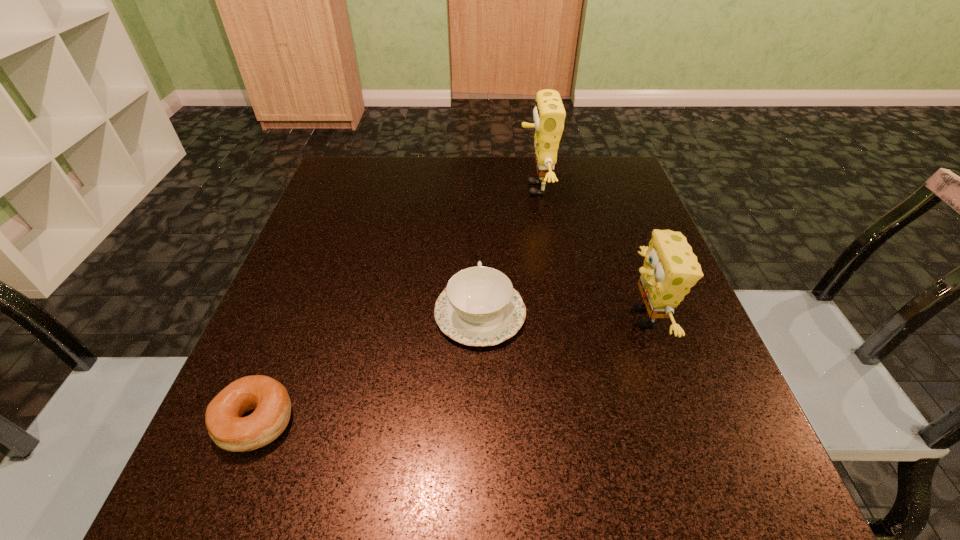
The width and height of the screenshot is (960, 540). Identify the location of vacant region located on the face of the taller sponge. (397, 188).

The image size is (960, 540). Identify the location of vacant point located 0.190m on the face of the rightmost object. (518, 318).

This screenshot has width=960, height=540. I want to click on free space located on the face of the rightmost object, so click(x=446, y=318).

The width and height of the screenshot is (960, 540). Identify the location of vacant space situated 0.250m on the face of the rightmost object. (485, 318).

Where is `blank area located 0.230m on the handle side of the chinaware`? The width and height of the screenshot is (960, 540). blank area located 0.230m on the handle side of the chinaware is located at coordinates (480, 213).

Where is `vacant space located on the handle side of the chinaware`? This screenshot has width=960, height=540. vacant space located on the handle side of the chinaware is located at coordinates (480, 238).

The height and width of the screenshot is (540, 960). What are the coordinates of `free space located on the handle side of the chinaware` in the screenshot? It's located at (480, 206).

You are a GUI agent. You are given a task and a screenshot of the screen. Output one action in this format:
    pyautogui.click(x=<x>, y=<y>)
    Task: Click on the blank area located 0.220m on the back of the shortest object
    The width and height of the screenshot is (960, 540).
    Given the screenshot: What is the action you would take?
    pyautogui.click(x=307, y=289)

At what (x,y) coordinates should I click in order to perform the action: click on object at the far edge. Please return your answer as a coordinate pair (x, y). Looking at the image, I should click on (549, 114).

Locate an element on the screen. object at the near edge is located at coordinates (269, 399).